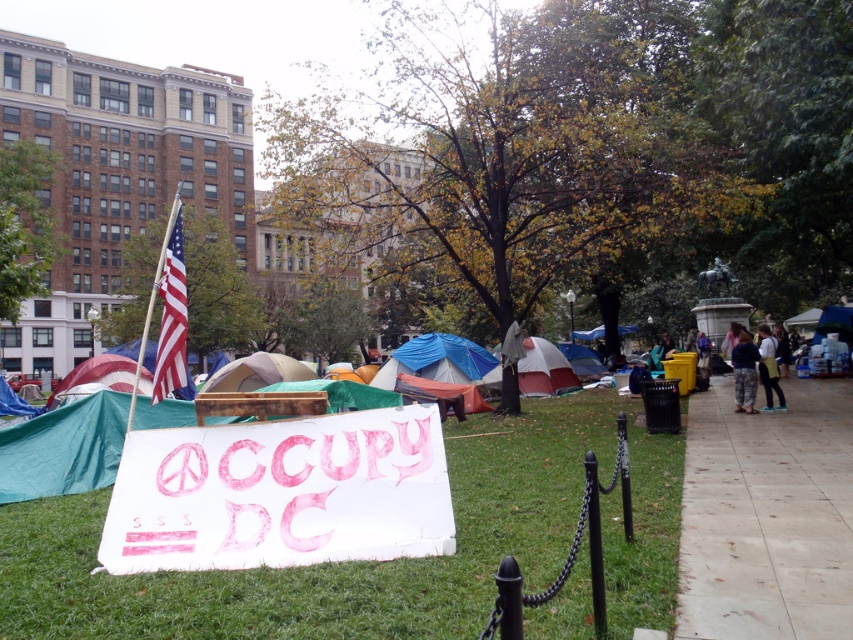
In the scene shown: Does american flag at upper left have a lesser width compared to american flag fabric tent at center-left?

No, american flag at upper left is not thinner than american flag fabric tent at center-left.

Does american flag at upper left appear on the left side of american flag fabric tent at center-left?

Indeed, american flag at upper left is positioned on the left side of american flag fabric tent at center-left.

Image resolution: width=853 pixels, height=640 pixels. What do you see at coordinates (171, 312) in the screenshot? I see `american flag at upper left` at bounding box center [171, 312].

Find the location of a particular element. This screenshot has height=640, width=853. american flag at upper left is located at coordinates (171, 312).

What do you see at coordinates (380, 561) in the screenshot? The width and height of the screenshot is (853, 640). I see `green grass at center` at bounding box center [380, 561].

Is point (485, 497) closer to viewer compared to point (759, 490)?

That is False.

This screenshot has width=853, height=640. I want to click on green grass at center, so click(380, 561).

Which is in front, point (438, 516) or point (753, 580)?

Positioned in front is point (753, 580).

Between white paper sign at center and smooth concrete pavement at right, which one appears on the left side from the viewer's perspective?

white paper sign at center is more to the left.

Between point (334, 502) and point (728, 467), which one is positioned behind?

Positioned behind is point (728, 467).

You are a GUI agent. You are given a task and a screenshot of the screen. Output one action in this format:
    pyautogui.click(x=<x>, y=<y>)
    Task: Click on the white paper sign at center
    The height and width of the screenshot is (640, 853).
    Given the screenshot: What is the action you would take?
    pyautogui.click(x=280, y=493)